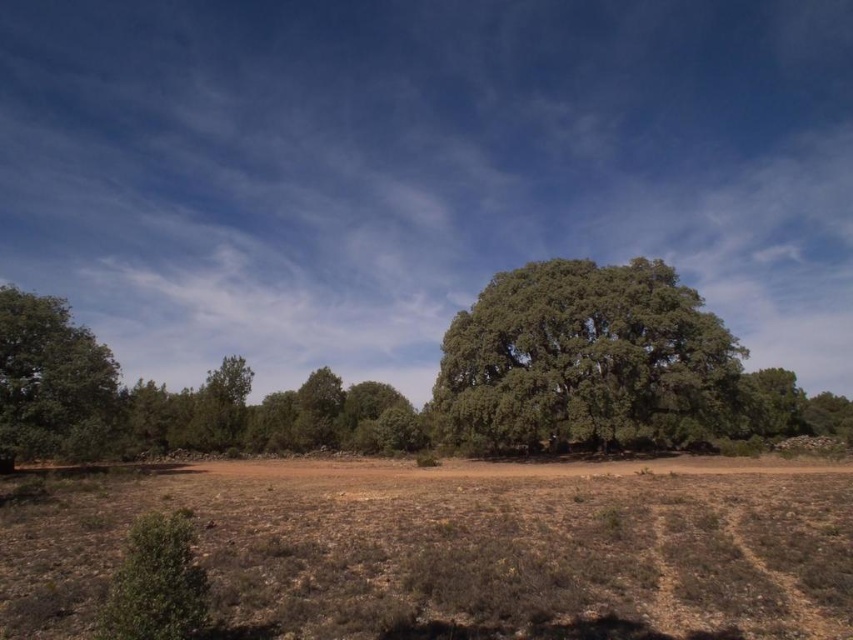
You are a hiker standing at the edge of the dry field. You notice brown dry grass at lower center and green leafy tree at center. Which object is closer to you?

The brown dry grass at lower center is positioned under the green leafy tree at center, so the brown dry grass at lower center is closer to you.